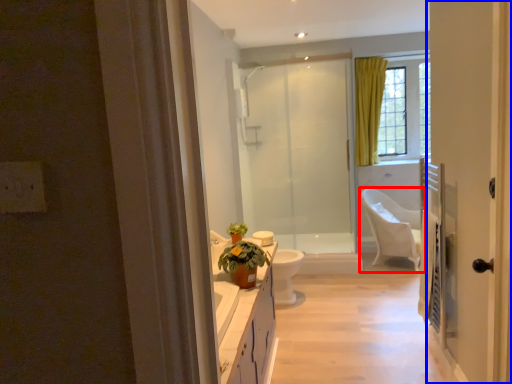
Question: Which object appears closest to the camera in this image, chair (highlighted by a red box) or door (highlighted by a blue box)?

Choices:
 (A) chair
 (B) door

Answer: (B)